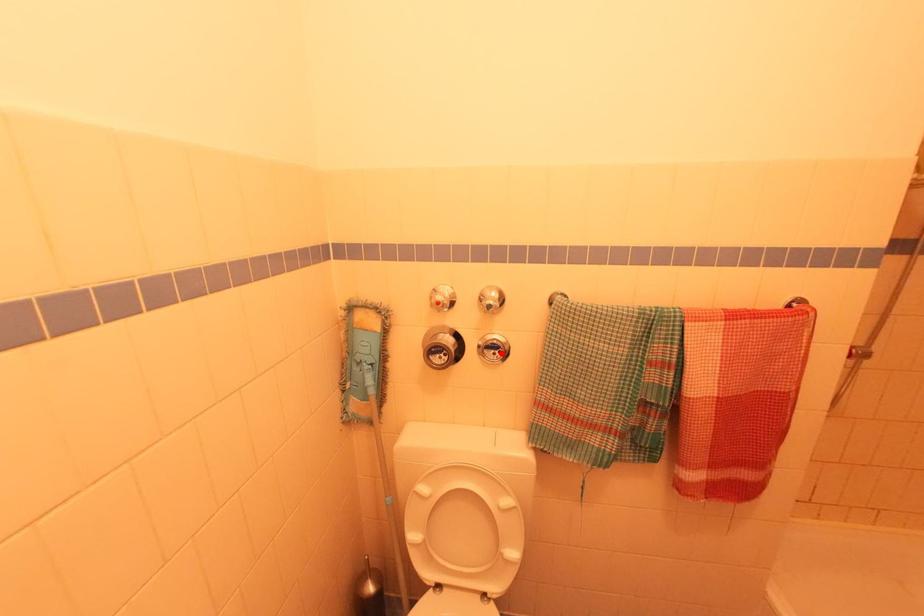
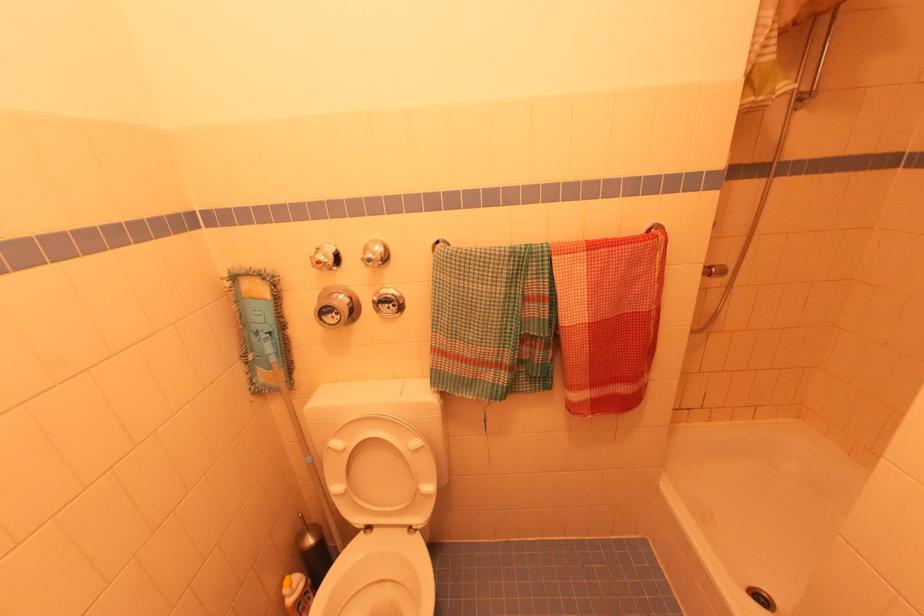
Find the pixel in the second image that matches the highlighted location in the first image.

(395, 306)